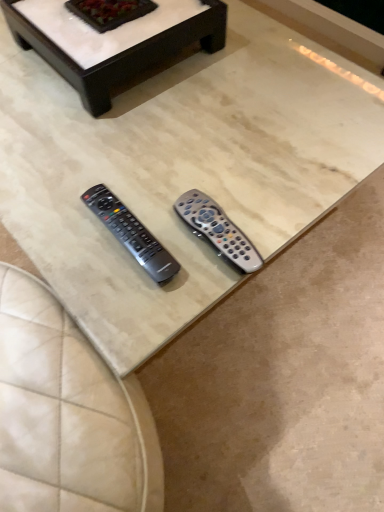
Identify the location of free area in between silver metallic remote at center, which is counted as the first remote control, starting from the left, and translucent gray remote at center, positioned as the 2th remote control in left-to-right order. (169, 225).